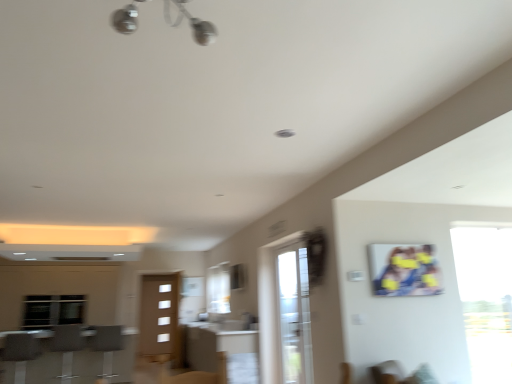
Measure the distance between point (304, 297) and camera.

They are 4.38 meters apart.

This screenshot has width=512, height=384. In order to click on metallic chrome light fixture at upper center in this screenshot , I will do `click(191, 23)`.

The height and width of the screenshot is (384, 512). Identify the location of transparent glass window at right. (486, 297).

This screenshot has height=384, width=512. I want to click on matte brown table at center, so click(x=222, y=351).

The width and height of the screenshot is (512, 384). What are the coordinates of `clear glass screen door at center` in the screenshot? It's located at (295, 316).

Locate an element on the screen. light fixture in front of the transparent glass window at right is located at coordinates (191, 23).

From a real-world perspective, is metallic chrome light fixture at upper center located beneath transparent glass window at right?

No, from a real-world perspective, metallic chrome light fixture at upper center is not under transparent glass window at right.

Is metallic chrome light fixture at upper center placed right next to transparent glass window at right?

There is a gap between metallic chrome light fixture at upper center and transparent glass window at right.

Who is bigger, metallic chrome light fixture at upper center or transparent glass window at right?

With larger size is transparent glass window at right.

From a real-world perspective, is matte brown table at center physically located above or below metallic chrome light fixture at upper center?

matte brown table at center is situated lower than metallic chrome light fixture at upper center in the real world.

Would you consider matte brown table at center to be distant from metallic chrome light fixture at upper center?

matte brown table at center is far away from metallic chrome light fixture at upper center.

Based on the photo, from the image's perspective, between matte brown table at center and metallic chrome light fixture at upper center, which one is located above?

metallic chrome light fixture at upper center.

Which is more to the left, matte brown table at center or metallic silver barstools at lower left?

metallic silver barstools at lower left is more to the left.

Is matte brown table at center facing towards metallic silver barstools at lower left?

Yes, matte brown table at center is aimed at metallic silver barstools at lower left.

How different are the orientations of matte brown table at center and metallic silver barstools at lower left in degrees?

There is a 90.4-degree angle between the facing directions of matte brown table at center and metallic silver barstools at lower left.

Is metallic chrome light fixture at upper center in contact with matte brown table at center?

They are not placed beside each other.

From a real-world perspective, does metallic chrome light fixture at upper center stand above matte brown table at center?

Yes.

Which object is positioned more to the left, metallic chrome light fixture at upper center or matte brown table at center?

matte brown table at center is more to the left.

How many degrees apart are the facing directions of metallic chrome light fixture at upper center and matte brown table at center?

The angle between the facing direction of metallic chrome light fixture at upper center and the facing direction of matte brown table at center is 180 degrees.

Considering the sizes of objects clear glass screen door at center and metallic chrome light fixture at upper center in the image provided, who is thinner, clear glass screen door at center or metallic chrome light fixture at upper center?

clear glass screen door at center.

From the image's perspective, which is below, clear glass screen door at center or metallic chrome light fixture at upper center?

From the image's view, clear glass screen door at center is below.

Can you tell me how much clear glass screen door at center and metallic chrome light fixture at upper center differ in facing direction?

180 degrees separate the facing orientations of clear glass screen door at center and metallic chrome light fixture at upper center.

Is clear glass screen door at center not close to metallic chrome light fixture at upper center?

That's right, there is a large distance between clear glass screen door at center and metallic chrome light fixture at upper center.

Can you confirm if transparent glass window at right is thinner than metallic chrome light fixture at upper center?

Yes, transparent glass window at right is thinner than metallic chrome light fixture at upper center.

Is transparent glass window at right looking in the opposite direction of metallic chrome light fixture at upper center?

No, transparent glass window at right's orientation is not away from metallic chrome light fixture at upper center.

In terms of height, does transparent glass window at right look taller or shorter compared to metallic chrome light fixture at upper center?

In the image, transparent glass window at right appears to be taller than metallic chrome light fixture at upper center.

Can you tell me how much transparent glass window at right and metallic chrome light fixture at upper center differ in facing direction?

The angle between the facing direction of transparent glass window at right and the facing direction of metallic chrome light fixture at upper center is 89.9 degrees.

From the image's perspective, which one is positioned lower, metallic silver barstools at lower left or transparent glass window at right?

metallic silver barstools at lower left is shown below in the image.

Can you confirm if metallic silver barstools at lower left is wider than transparent glass window at right?

Answer: Indeed, metallic silver barstools at lower left has a greater width compared to transparent glass window at right.

This screenshot has height=384, width=512. I want to click on window above the metallic silver barstools at lower left (from the image's perspective), so click(x=486, y=297).

Find the location of a particular element. This screenshot has width=512, height=384. light fixture above the transparent glass window at right (from the image's perspective) is located at coordinates coord(191,23).

This screenshot has height=384, width=512. Identify the location of table below the metallic chrome light fixture at upper center (from a real-world perspective). point(222,351).

Considering their positions, is metallic silver barstools at lower left positioned closer to transparent glass window at right than matte brown table at center?

Among the two, matte brown table at center is located nearer to transparent glass window at right.

Based on the photo, considering their positions, is transparent glass window at right positioned further to metallic chrome light fixture at upper center than matte brown table at center?

matte brown table at center is positioned further to the anchor metallic chrome light fixture at upper center.

Estimate the real-world distances between objects in this image. Which object is further from metallic silver barstools at lower left, metallic chrome light fixture at upper center or clear glass screen door at center?

The object further to metallic silver barstools at lower left is metallic chrome light fixture at upper center.

Considering their positions, is transparent glass window at right positioned further to metallic silver barstools at lower left than matte brown table at center?

transparent glass window at right is further to metallic silver barstools at lower left.

When comparing their distances from metallic silver barstools at lower left, does clear glass screen door at center or matte brown table at center seem further?

clear glass screen door at center.

From the image, which object appears to be farther from metallic chrome light fixture at upper center, metallic silver barstools at lower left or clear glass screen door at center?

metallic silver barstools at lower left is positioned further to the anchor metallic chrome light fixture at upper center.

From the image, which object appears to be nearer to metallic chrome light fixture at upper center, clear glass screen door at center or transparent glass window at right?

clear glass screen door at center is closer to metallic chrome light fixture at upper center.

From the image, which object appears to be farther from matte brown table at center, metallic silver barstools at lower left or transparent glass window at right?

transparent glass window at right is further to matte brown table at center.

Locate an element on the screen. window between metallic chrome light fixture at upper center and matte brown table at center along the z-axis is located at coordinates (486, 297).

The image size is (512, 384). I want to click on screen door between metallic silver barstools at lower left and transparent glass window at right from left to right, so (295, 316).

Locate an element on the screen. The width and height of the screenshot is (512, 384). table between metallic silver barstools at lower left and clear glass screen door at center from left to right is located at coordinates (222, 351).

I want to click on light fixture situated between metallic silver barstools at lower left and transparent glass window at right from left to right, so click(x=191, y=23).